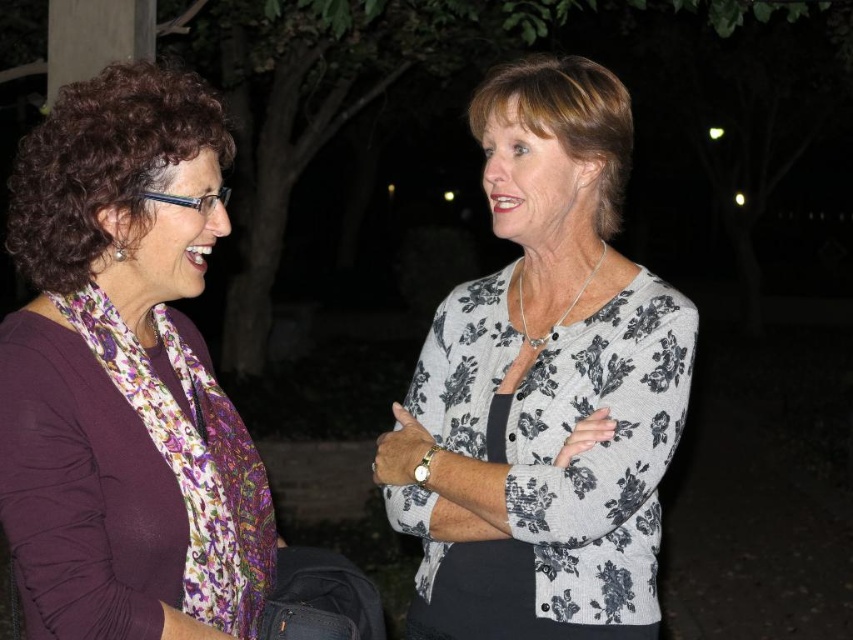
You are a photographer trying to capture the purple matte scarf at left in the image. The camera you are using has a focus point at coordinate point (138, 390). Based on the scene description, can you confirm if the focus point is correctly positioned to capture the purple matte scarf at left?

Yes, the focus point at coordinate point (138, 390) is correctly positioned to capture the purple matte scarf at left because the point indicates the location of the purple matte scarf at left.